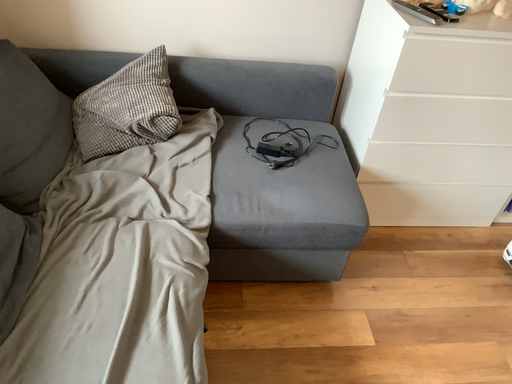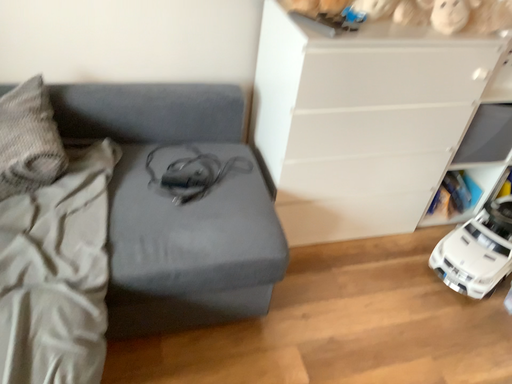
Question: Which way did the camera rotate in the video?

Choices:
 (A) rotated right
 (B) rotated left

Answer: (A)